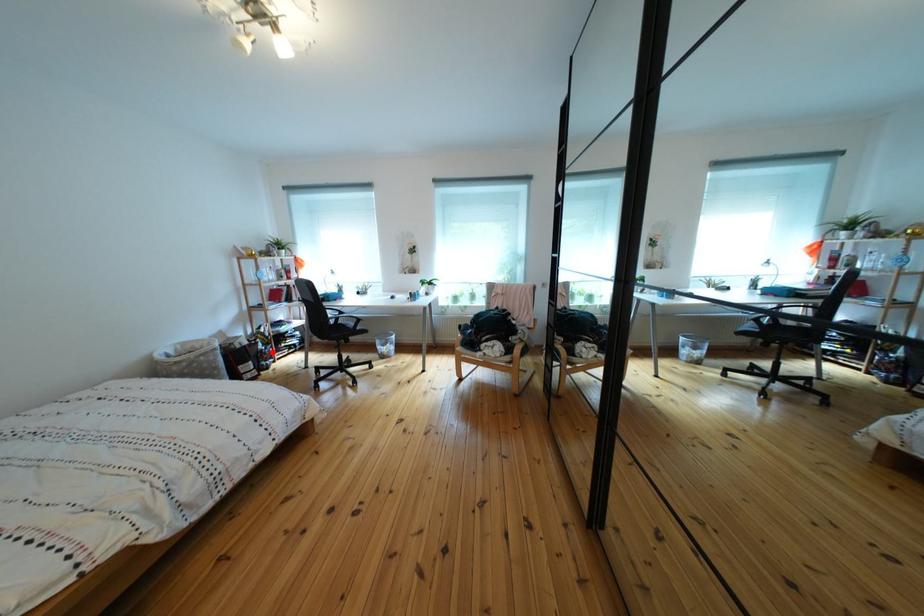
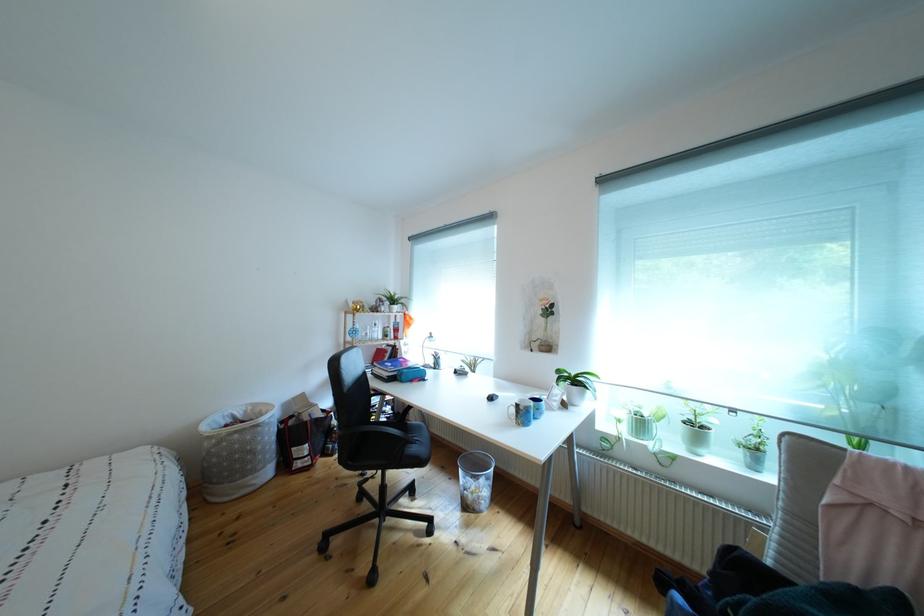
In the second image, find the point that corresponds to the highlighted location in the first image.

(346, 428)